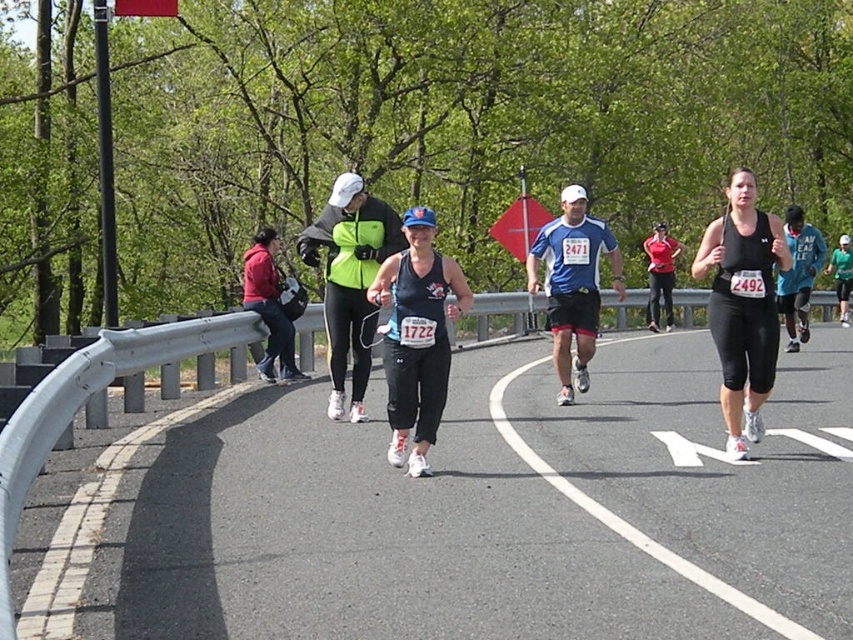
You are a photographer at the marathon and want to capture a photo of the runners. You notice the matte black tank top at center and the neon green fabric at center. Which runner should you focus on to get the one on the left side of the image?

The neon green fabric at center is to the left of the matte black tank top at center, so focusing on the neon green fabric at center will capture the runner on the left side of the image.

You are a spectator at the marathon and want to take a photo of the runners. You notice the matte black tank top at center and the teal fabric shirt at right. Which runner is positioned lower in the image?

The matte black tank top at center is located below the teal fabric shirt at right, so the runner wearing the matte black tank top at center is positioned lower in the image.